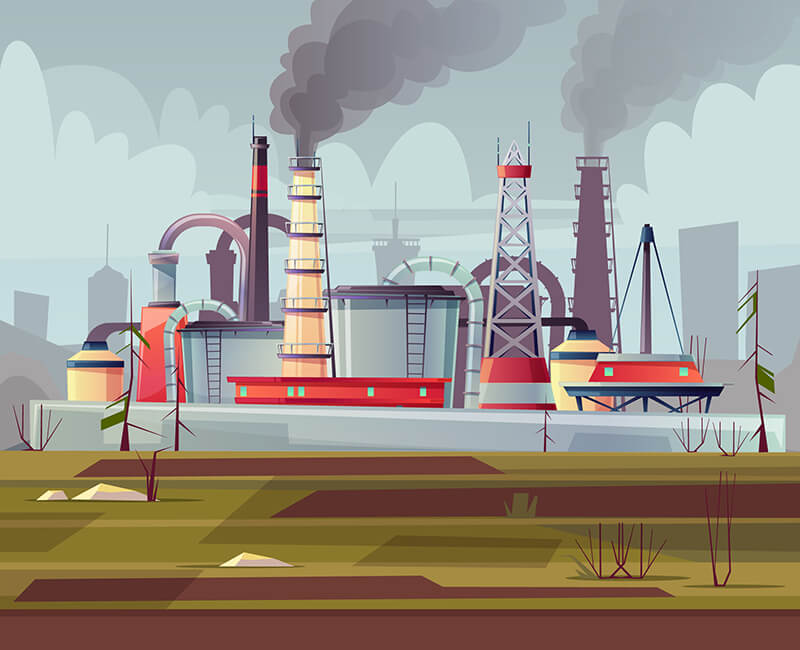
Locate an element on the screen. green windows is located at coordinates (678, 372), (610, 372), (422, 391), (370, 390), (298, 387), (292, 390), (244, 393).